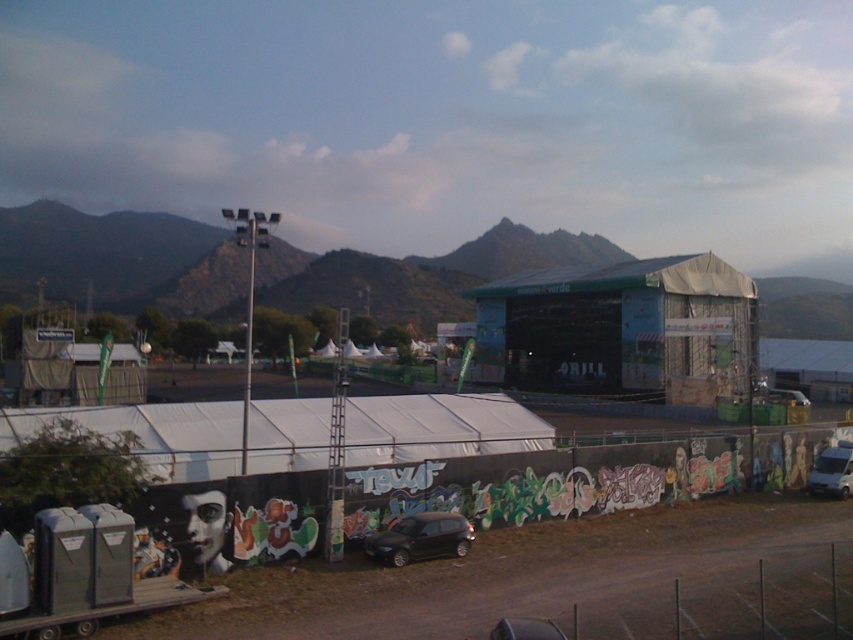
You are a painter who wants to set up an easel to paint the black and white portrait on the left side of the graffiti wall. You have two options for placement near the lower right corner of the image. One spot is behind the metallic wire fence at lower right, and the other is behind the white matte van at lower right. Which location would allow you to see the entire portrait without obstruction?

The metallic wire fence at lower right is taller than the white matte van at lower right. Therefore, placing the easel behind the white matte van at lower right would allow you to see the entire portrait without obstruction because the shorter van would block less of the view compared to the taller fence.

You are standing in front of a large graffiti wall. You notice two points marked on the wall. The first point is at coordinates point (844, 480) and the second is at point (807, 403). Which of these points is closer to you?

Point (844, 480) is closer to the viewer than point (807, 403).

You are a photographer setting up equipment near the metallic wire fence at lower right and the white matte van at lower right. You want to take a photo of the graffiti wall without any obstructions. Which object should you move to ensure the graffiti wall is fully visible?

The metallic wire fence at lower right is in front of the white matte van at lower right. To ensure the graffiti wall is fully visible, you should move the metallic wire fence at lower right out of the way since it is blocking the view.